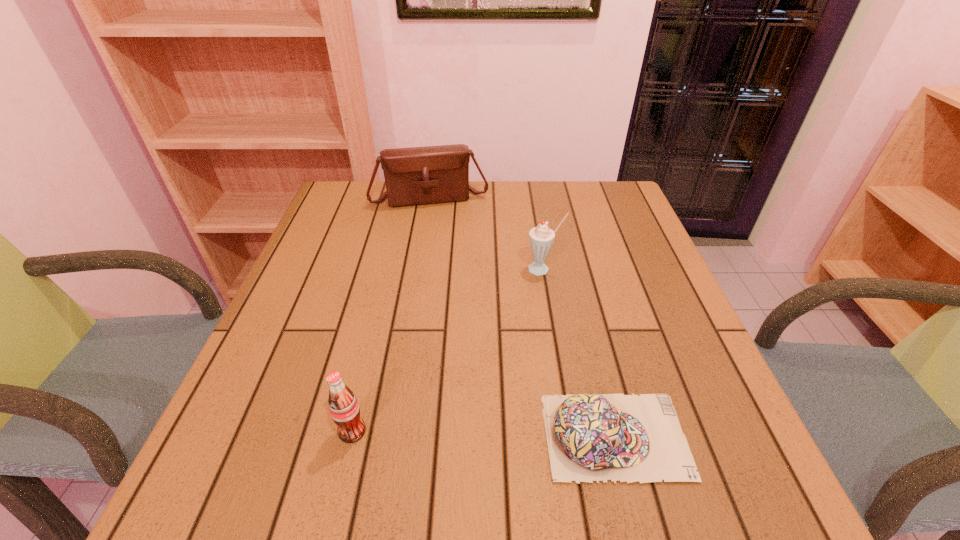
Where is `vacant space on the desktop that is between the soda and the shortest object and is positioned on the straw side of the milkshake`? This screenshot has width=960, height=540. vacant space on the desktop that is between the soda and the shortest object and is positioned on the straw side of the milkshake is located at coordinates (464, 433).

Where is `vacant space on the desktop that is between the soda and the cap and is positioned on the front flap of the farthest object`? vacant space on the desktop that is between the soda and the cap and is positioned on the front flap of the farthest object is located at coordinates (477, 434).